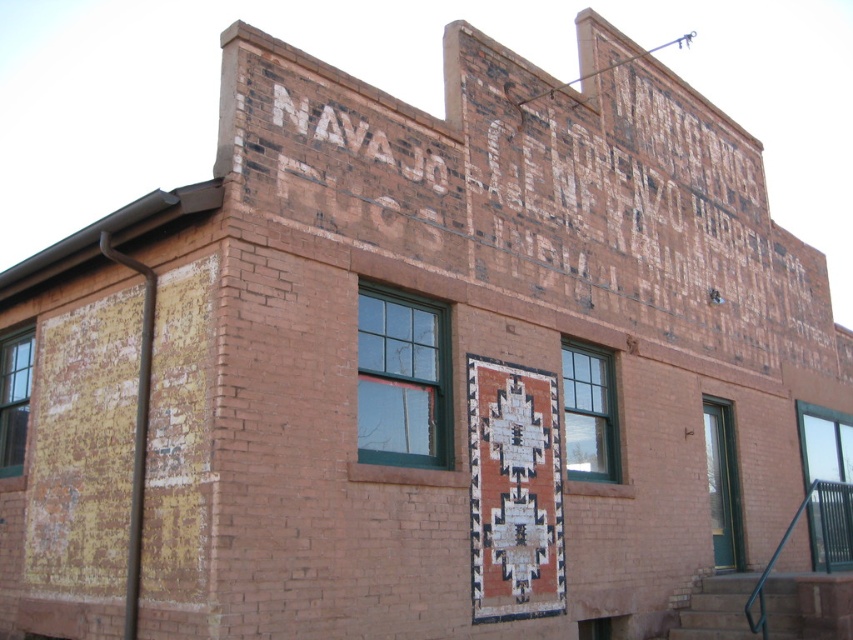
Question: Does clear glass door at lower right have a lesser width compared to green glass window at center?

Choices:
 (A) no
 (B) yes

Answer: (A)

Question: Which of the following is the closest to the observer?

Choices:
 (A) green wood window at center
 (B) green glass window at center
 (C) clear glass window at lower left
 (D) green glass door at right

Answer: (A)

Question: Does clear glass door at lower right have a larger size compared to clear glass window at lower left?

Choices:
 (A) no
 (B) yes

Answer: (B)

Question: Among these points, which one is nearest to the camera?

Choices:
 (A) (724, 429)
 (B) (798, 426)
 (C) (601, 397)

Answer: (C)

Question: From the image, what is the correct spatial relationship of green wood window at center in relation to clear glass door at lower right?

Choices:
 (A) below
 (B) above

Answer: (B)

Question: Which object is farther from the camera taking this photo?

Choices:
 (A) clear glass window at lower left
 (B) clear glass door at lower right
 (C) green glass door at right
 (D) green glass window at center

Answer: (B)